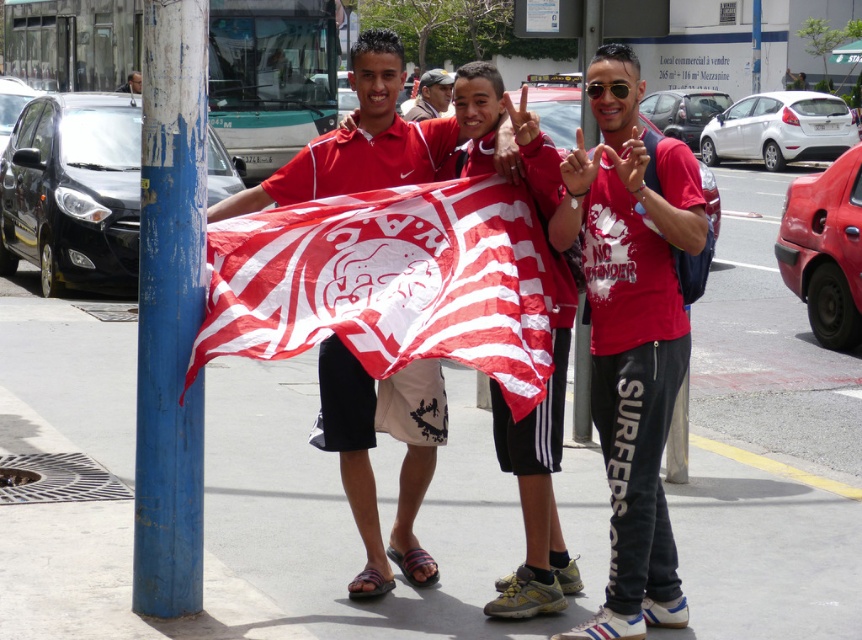
Based on the photo, you are a photographer trying to capture a clear shot of both the matte red flag at center and the blue painted pole at center. Given their sizes, which object should you focus on first to ensure it fits entirely within your camera frame?

The matte red flag at center has a smaller size compared to the blue painted pole at center, so you should focus on capturing the blue painted pole at center first since it is larger and requires more space in the frame to ensure both objects are fully visible.

You are a photographer trying to capture the entire scene in one shot. The blue painted wood pole at left and the matte red flag at center are both in your frame. Which object should you adjust your camera angle to prioritize if you want to ensure the shorter object remains fully visible?

The blue painted wood pole at left is taller than the matte red flag at center, so you should prioritize adjusting your camera angle to ensure the shorter matte red flag at center stays fully visible.